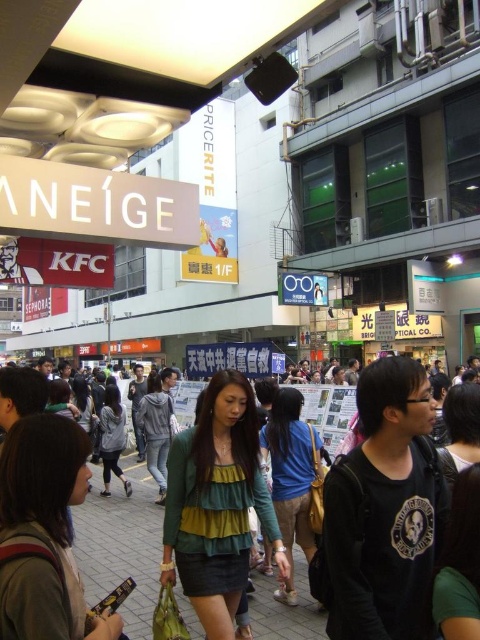
Question: Which object is the farthest from the green jersey at center?

Choices:
 (A) green fabric jacket at center
 (B) matte gray shirt at lower left
 (C) dark gray concrete pavement at center
 (D) gray hoodie at center

Answer: (D)

Question: Considering the real-world distances, which object is closest to the dark gray concrete pavement at center?

Choices:
 (A) green fabric jacket at center
 (B) gray fabric jacket at center

Answer: (A)

Question: Where is green layered top at center located in relation to gray fabric jacket at center in the image?

Choices:
 (A) left
 (B) right

Answer: (B)

Question: Which object is positioned closest to the matte gray shirt at lower left?

Choices:
 (A) gray fabric jacket at center
 (B) dark gray concrete pavement at center
 (C) green layered top at center
 (D) green matte shirt at center

Answer: (C)

Question: Does gray hoodie at center have a greater width compared to gray fabric jacket at center?

Choices:
 (A) no
 (B) yes

Answer: (A)

Question: Is matte gray shirt at lower left further to camera compared to gray fabric jacket at center?

Choices:
 (A) no
 (B) yes

Answer: (A)